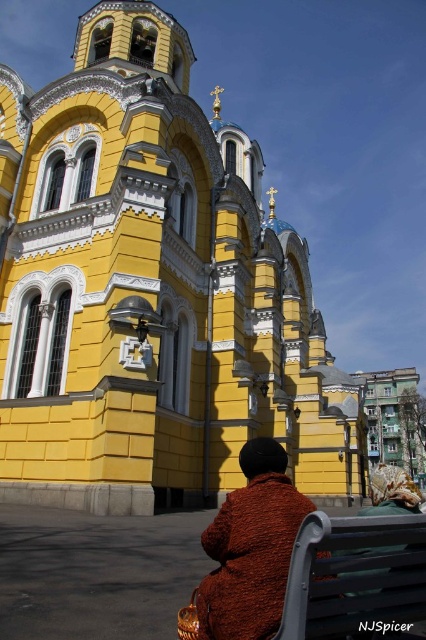
Between point (198, 608) and point (356, 560), which one is positioned behind?

Positioned behind is point (198, 608).

Does point (209, 529) come behind point (362, 563)?

That is True.

Where is `knitted brown coat at center`? This screenshot has height=640, width=426. knitted brown coat at center is located at coordinates (250, 547).

Who is taller, metallic gray bench at lower right or brown fuzzy coat at lower right?

brown fuzzy coat at lower right is taller.

Does metallic gray bench at lower right appear over brown fuzzy coat at lower right?

Yes.

Is point (412, 593) positioned in front of point (385, 465)?

Yes, point (412, 593) is closer to viewer.

Locate an element on the screen. The width and height of the screenshot is (426, 640). metallic gray bench at lower right is located at coordinates (354, 576).

Looking at this image, does yellow stone church at center have a greater height compared to knitted brown coat at center?

Indeed, yellow stone church at center has a greater height compared to knitted brown coat at center.

What are the coordinates of `yellow stone church at center` in the screenshot? It's located at (152, 291).